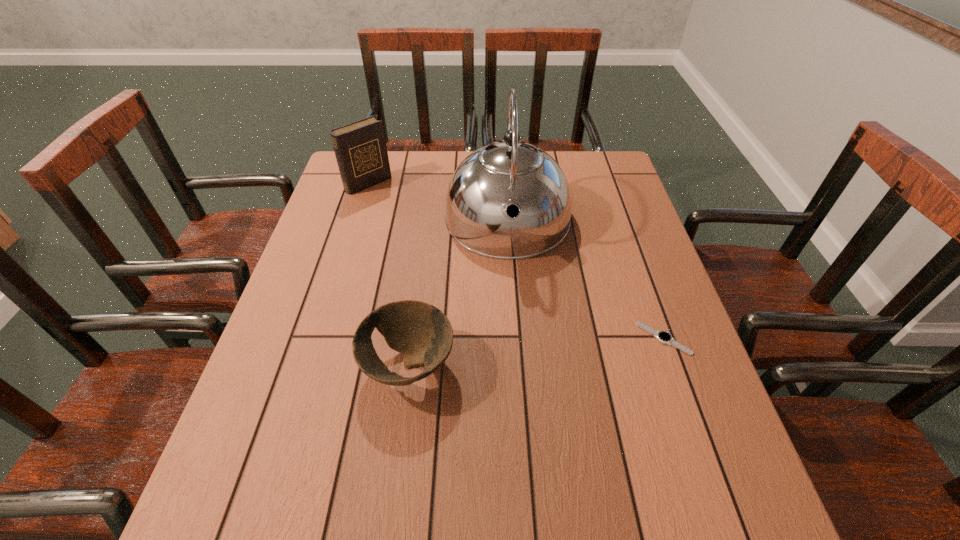
This screenshot has width=960, height=540. I want to click on blank area located from the spout of the kettle, so click(x=516, y=413).

This screenshot has height=540, width=960. I want to click on free space located on the front cover of the diary, so click(413, 220).

This screenshot has height=540, width=960. Find the location of `free space located on the front cover of the diary`. free space located on the front cover of the diary is located at coordinates (433, 238).

Locate an element on the screen. This screenshot has width=960, height=540. vacant space located 0.370m on the front cover of the diary is located at coordinates coord(452,255).

Identify the location of kettle that is positioned at the far edge. (511, 175).

Locate an element on the screen. The width and height of the screenshot is (960, 540). diary present at the far edge is located at coordinates (360, 148).

You are a GUI agent. You are given a task and a screenshot of the screen. Output one action in this format:
    pyautogui.click(x=<x>, y=<y>)
    Task: Click on the object that is at the left edge
    Image resolution: width=960 pixels, height=540 pixels.
    Given the screenshot: What is the action you would take?
    pyautogui.click(x=360, y=148)

In order to click on object located in the right edge section of the desktop in this screenshot , I will do `click(664, 337)`.

The height and width of the screenshot is (540, 960). In order to click on object present at the far left corner in this screenshot , I will do [360, 148].

This screenshot has height=540, width=960. I want to click on free space at the far edge of the desktop, so click(x=420, y=167).